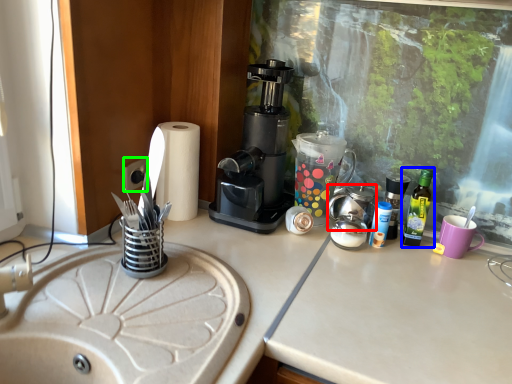
Question: Which object is positioned closest to appliance (highlighted by a red box)? Select from bottle (highlighted by a blue box) and electric outlet (highlighted by a green box).

Choices:
 (A) bottle
 (B) electric outlet

Answer: (A)